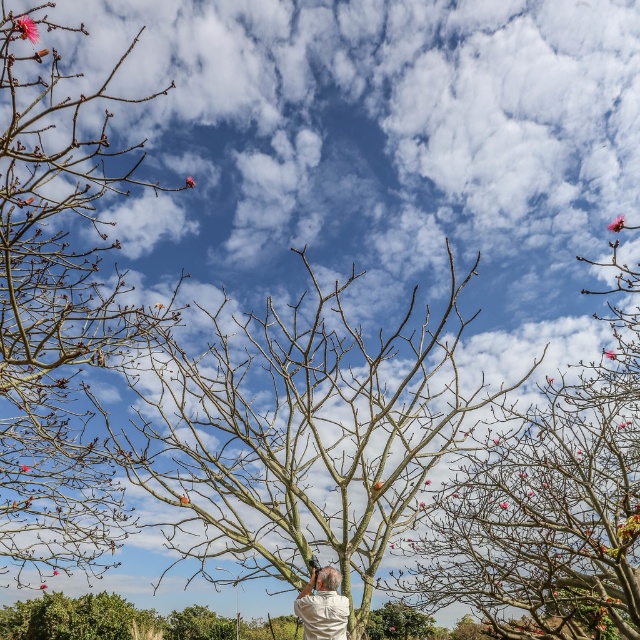
Who is more distant from viewer, (305, 392) or (336, 582)?

Point (336, 582)

Is point (456, 369) less distant than point (312, 572)?

No.

Image resolution: width=640 pixels, height=640 pixels. What do you see at coordinates (300, 435) in the screenshot?
I see `bare branches at center` at bounding box center [300, 435].

Identify the location of bare branches at center. Image resolution: width=640 pixels, height=640 pixels. (300, 435).

Is bare branches at left taller than bare branches at upper right?

Indeed, bare branches at left has a greater height compared to bare branches at upper right.

Can you confirm if bare branches at left is positioned to the right of bare branches at upper right?

In fact, bare branches at left is to the left of bare branches at upper right.

Where is `bare branches at left`? This screenshot has width=640, height=640. bare branches at left is located at coordinates (54, 308).

Between bare branches at center and bare branches at left, which one is positioned higher?

Positioned higher is bare branches at left.

Is bare branches at center below bare branches at left?

Correct, bare branches at center is located below bare branches at left.

Is point (396, 408) positioned in front of point (80, 346)?

No, (396, 408) is behind (80, 346).

Identify the location of bare branches at center. The height and width of the screenshot is (640, 640). (300, 435).